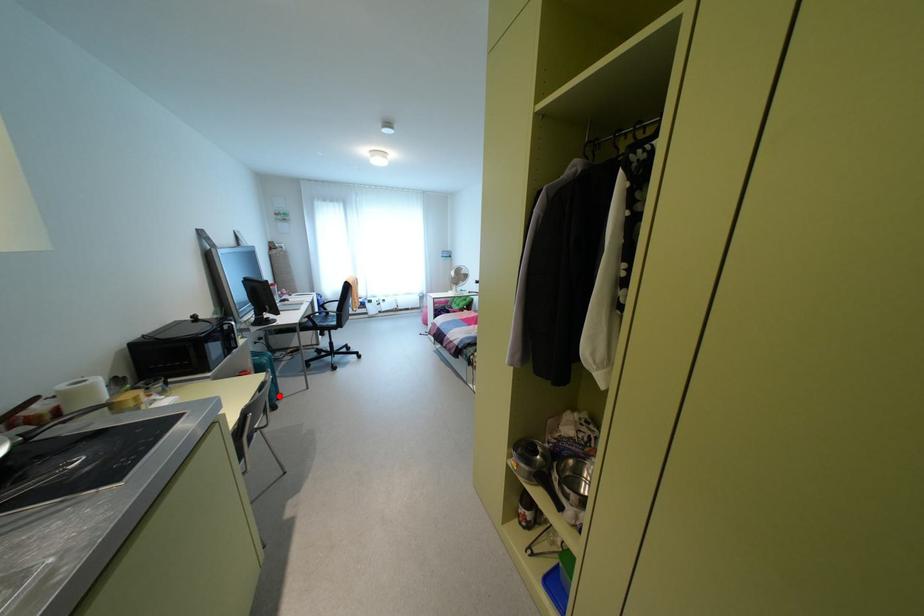
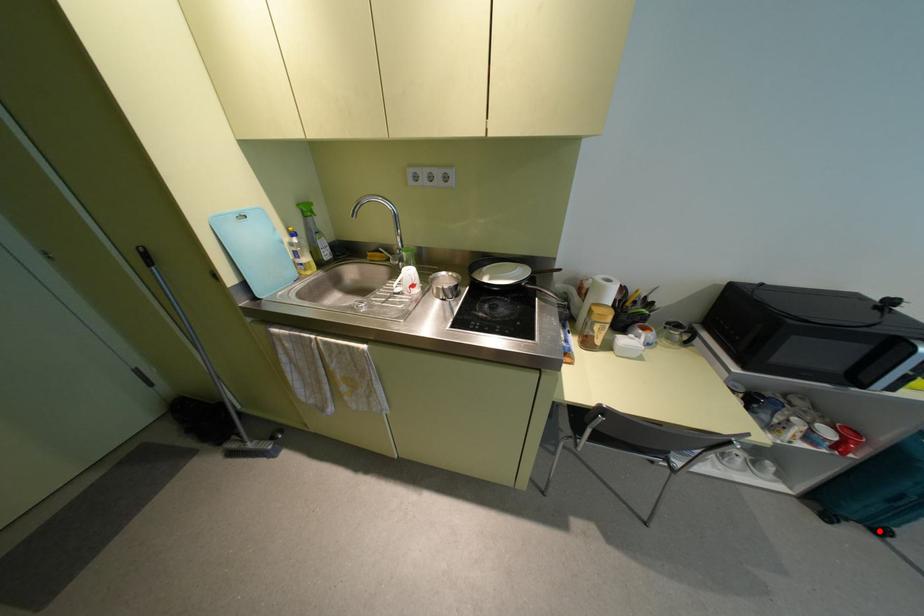
I am providing you with two images of the same scene from different viewpoints. A red point is marked on the first image and another point is marked on the second image. Does the point marked in image1 correspond to the same location as the one in image2?

Yes